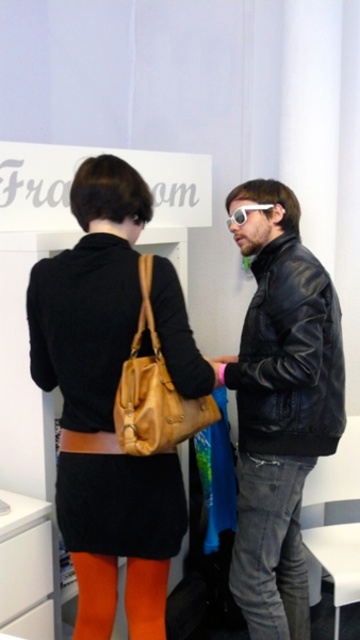
Question: Which point is closer to the camera?

Choices:
 (A) (165, 376)
 (B) (228, 227)
 (C) (303, 570)
 (D) (240, 472)

Answer: (A)

Question: Considering the real-world distances, which object is farthest from the white matte goggles at center?

Choices:
 (A) matte black dress at center
 (B) denim jeans at lower center
 (C) leather handbag at center

Answer: (B)

Question: Can you confirm if matte black dress at center is positioned above leather handbag at center?

Choices:
 (A) yes
 (B) no

Answer: (B)

Question: Can you confirm if black leather jacket at center is smaller than white matte goggles at center?

Choices:
 (A) yes
 (B) no

Answer: (B)

Question: Is denim jeans at lower center further to camera compared to leather handbag at center?

Choices:
 (A) no
 (B) yes

Answer: (B)

Question: Which object appears closest to the camera in this image?

Choices:
 (A) denim jeans at lower center
 (B) leather handbag at center
 (C) white matte goggles at center
 (D) black leather jacket at center

Answer: (B)